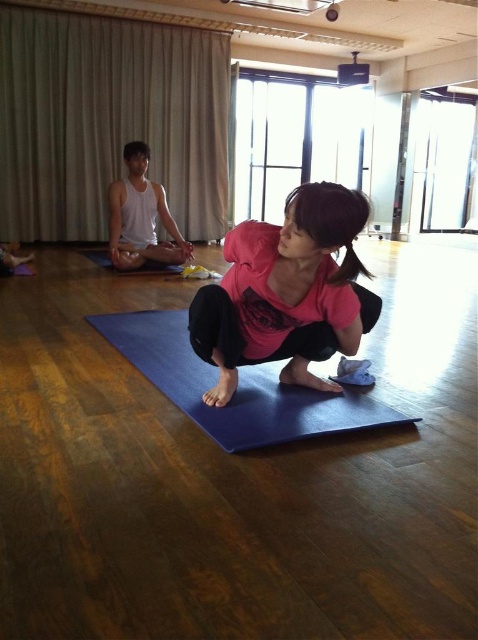
Between pink matte shirt at center and white tank top at center, which one appears on the right side from the viewer's perspective?

pink matte shirt at center is more to the right.

Is pink matte shirt at center shorter than white tank top at center?

Yes.

Is point (228, 342) closer to viewer compared to point (147, 221)?

Yes, it is in front of point (147, 221).

Where is `pink matte shirt at center`? pink matte shirt at center is located at coordinates (286, 292).

What do you see at coordinates (238, 387) in the screenshot? I see `blue rubber yoga mat at center` at bounding box center [238, 387].

Identify the location of blue rubber yoga mat at center. (238, 387).

What are the coordinates of `blue rubber yoga mat at center` in the screenshot? It's located at (238, 387).

Does pink matte shirt at center have a smaller size compared to blue rubber mat at center?

No, pink matte shirt at center is not smaller than blue rubber mat at center.

Between point (315, 234) and point (86, 250), which one is positioned behind?

Point (86, 250)

Is point (216, 328) positioned in front of point (101, 252)?

Yes, it is in front of point (101, 252).

Where is `pink matte shirt at center`? This screenshot has height=640, width=478. pink matte shirt at center is located at coordinates (286, 292).